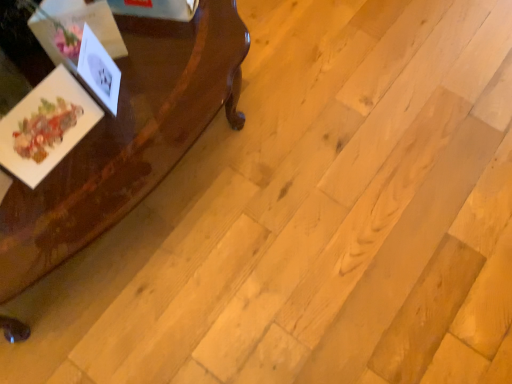
What do you see at coordinates (99, 71) in the screenshot? This screenshot has height=384, width=512. I see `white paper at left, which appears as the 2th postcard when viewed from the left` at bounding box center [99, 71].

Where is `white paper at left, which appears as the 2th postcard when viewed from the left`? The width and height of the screenshot is (512, 384). white paper at left, which appears as the 2th postcard when viewed from the left is located at coordinates (99, 71).

Does point (179, 30) come farther from viewer compared to point (31, 117)?

Yes, point (179, 30) is behind point (31, 117).

Find the location of `table on the left of matte paper postcard at left, the 2th postcard in the right-to-left sequence`. table on the left of matte paper postcard at left, the 2th postcard in the right-to-left sequence is located at coordinates (128, 139).

Who is smaller, glossy wood table at left or matte paper postcard at left, the 2th postcard in the right-to-left sequence?

matte paper postcard at left, the 2th postcard in the right-to-left sequence, is smaller.

Can you confirm if glossy wood table at left is shorter than matte paper postcard at left, the 2th postcard in the right-to-left sequence?

No.

Does white paper at left, which appears as the 1th postcard when viewed from the right, have a lesser height compared to glossy wood table at left?

Yes.

Could you measure the distance between white paper at left, which appears as the 2th postcard when viewed from the left, and glossy wood table at left?

white paper at left, which appears as the 2th postcard when viewed from the left, and glossy wood table at left are 6.51 inches apart from each other.

Looking at their sizes, would you say white paper at left, which appears as the 1th postcard when viewed from the right, is wider or thinner than glossy wood table at left?

In the image, white paper at left, which appears as the 1th postcard when viewed from the right, appears to be more narrow than glossy wood table at left.

From a real-world perspective, between white paper at left, which appears as the 2th postcard when viewed from the left, and glossy wood table at left, who is vertically lower?

glossy wood table at left.

What are the coordinates of `postcard above the matte paper postcard at left, the 2th postcard in the right-to-left sequence (from a real-world perspective)` in the screenshot? It's located at (99, 71).

Could white paper at left, which appears as the 2th postcard when viewed from the left, be considered to be inside matte paper postcard at left, the 2th postcard in the right-to-left sequence?

No, white paper at left, which appears as the 2th postcard when viewed from the left, is located outside of matte paper postcard at left, the 2th postcard in the right-to-left sequence.

Which of these two, matte paper postcard at left, the 2th postcard in the right-to-left sequence, or white paper at left, which appears as the 1th postcard when viewed from the right, is wider?

With larger width is matte paper postcard at left, the 2th postcard in the right-to-left sequence.

Which of these two, white paper at left, which appears as the 1th postcard when viewed from the right, or matte paper postcard at left, the 1th postcard in the left-to-right sequence, is smaller?

white paper at left, which appears as the 1th postcard when viewed from the right, is smaller.

In order to click on postcard in front of the white paper at left, which appears as the 1th postcard when viewed from the right in this screenshot , I will do `click(46, 126)`.

Is point (82, 40) farther from viewer compared to point (74, 126)?

No, it is not.

Measure the distance from white paper at left, which appears as the 2th postcard when viewed from the left, to matte paper postcard at left, the 2th postcard in the right-to-left sequence.

white paper at left, which appears as the 2th postcard when viewed from the left, and matte paper postcard at left, the 2th postcard in the right-to-left sequence, are 9.81 centimeters apart.

From the image's perspective, is matte paper postcard at left, the 2th postcard in the right-to-left sequence, above glossy wood table at left?

Yes.

Which point is more distant from viewer, [37,129] or [206,51]?

The point [206,51] is behind.

In the scene shown: Is matte paper postcard at left, the 1th postcard in the left-to-right sequence, wider or thinner than glossy wood table at left?

Considering their sizes, matte paper postcard at left, the 1th postcard in the left-to-right sequence, looks slimmer than glossy wood table at left.

From a real-world perspective, which is physically below, glossy wood table at left or white paper at left, which appears as the 1th postcard when viewed from the right?

glossy wood table at left is physically lower.

Considering the positions of objects glossy wood table at left and white paper at left, which appears as the 2th postcard when viewed from the left, in the image provided, who is more to the left, glossy wood table at left or white paper at left, which appears as the 2th postcard when viewed from the left,?

glossy wood table at left is more to the left.

Locate an element on the screen. This screenshot has width=512, height=384. the 2nd postcard counting from the right side of the glossy wood table at left is located at coordinates (99, 71).

Find the location of a particular element. This screenshot has height=384, width=512. the 1st postcard behind the glossy wood table at left is located at coordinates (46, 126).

Locate an element on the screen. Image resolution: width=512 pixels, height=384 pixels. the 2nd postcard located above the glossy wood table at left (from a real-world perspective) is located at coordinates (99, 71).

When comparing their distances from white paper at left, which appears as the 1th postcard when viewed from the right, does matte paper postcard at left, the 2th postcard in the right-to-left sequence, or glossy wood table at left seem closer?

matte paper postcard at left, the 2th postcard in the right-to-left sequence, is closer to white paper at left, which appears as the 1th postcard when viewed from the right.

In the scene shown: Looking at the image, which one is located closer to glossy wood table at left, white paper at left, which appears as the 2th postcard when viewed from the left, or matte paper postcard at left, the 2th postcard in the right-to-left sequence?

Among the two, matte paper postcard at left, the 2th postcard in the right-to-left sequence, is located nearer to glossy wood table at left.

Based on their spatial positions, is glossy wood table at left or white paper at left, which appears as the 1th postcard when viewed from the right, further from matte paper postcard at left, the 2th postcard in the right-to-left sequence?

glossy wood table at left is positioned further to the anchor matte paper postcard at left, the 2th postcard in the right-to-left sequence.

In the scene shown: When comparing their distances from glossy wood table at left, does matte paper postcard at left, the 2th postcard in the right-to-left sequence, or white paper at left, which appears as the 2th postcard when viewed from the left, seem closer?

The object closer to glossy wood table at left is matte paper postcard at left, the 2th postcard in the right-to-left sequence.

Estimate the real-world distances between objects in this image. Which object is closer to matte paper postcard at left, the 2th postcard in the right-to-left sequence, white paper at left, which appears as the 1th postcard when viewed from the right, or glossy wood table at left?

The object closer to matte paper postcard at left, the 2th postcard in the right-to-left sequence, is white paper at left, which appears as the 1th postcard when viewed from the right.

Considering their positions, is glossy wood table at left positioned further to white paper at left, which appears as the 2th postcard when viewed from the left, than matte paper postcard at left, the 2th postcard in the right-to-left sequence?

The object further to white paper at left, which appears as the 2th postcard when viewed from the left, is glossy wood table at left.

Image resolution: width=512 pixels, height=384 pixels. Identify the location of postcard situated between glossy wood table at left and white paper at left, which appears as the 1th postcard when viewed from the right, from left to right. (46, 126).